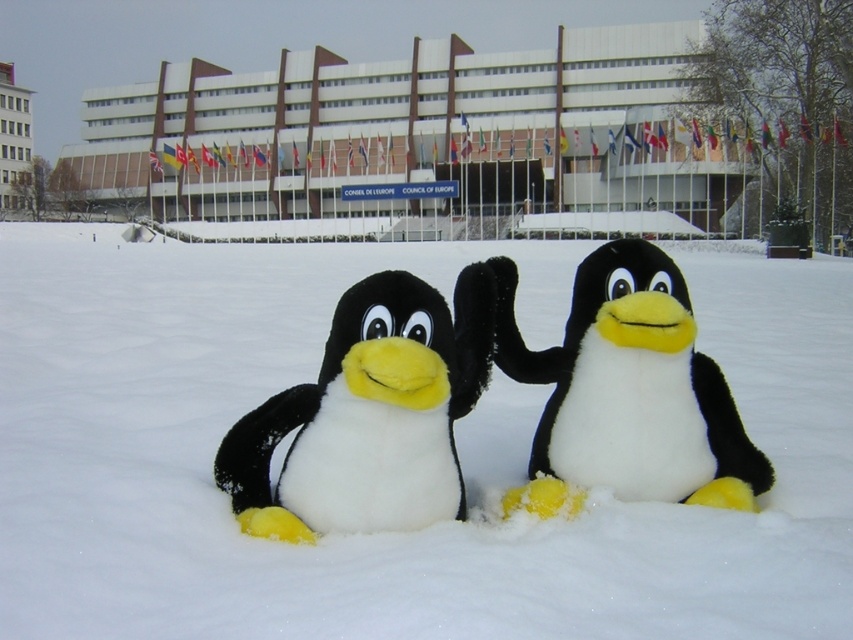
Question: Which point is farther from the camera taking this photo?

Choices:
 (A) (294, 451)
 (B) (672, 336)

Answer: (A)

Question: Can you confirm if white plush penguin at center is positioned to the right of fluffy black-and-white penguin at center?

Choices:
 (A) yes
 (B) no

Answer: (B)

Question: Is white fluffy snow at center positioned before white plush penguin at center?

Choices:
 (A) yes
 (B) no

Answer: (A)

Question: Which point is closer to the camera taking this photo?

Choices:
 (A) tap(535, 600)
 (B) tap(312, 410)

Answer: (A)

Question: Is the position of white fluffy snow at center more distant than that of white plush penguin at center?

Choices:
 (A) no
 (B) yes

Answer: (A)

Question: Which object is closer to the camera taking this photo?

Choices:
 (A) white fluffy snow at center
 (B) fluffy black-and-white penguin at center
 (C) white plush penguin at center

Answer: (A)